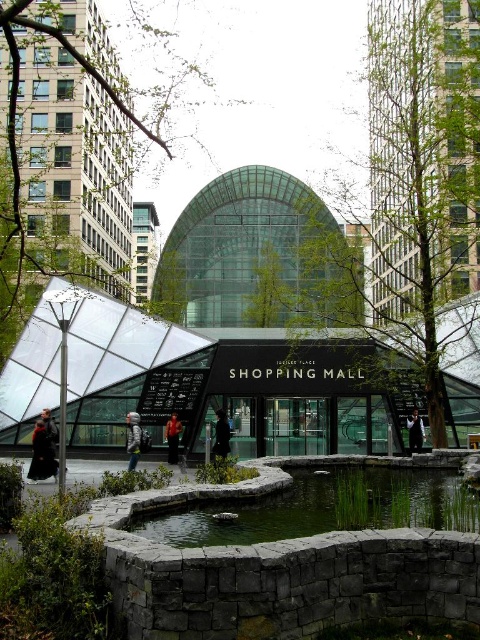
Question: Considering the relative positions of dark gray stone pond at center and denim jacket at center in the image provided, where is dark gray stone pond at center located with respect to denim jacket at center?

Choices:
 (A) right
 (B) left

Answer: (A)

Question: Does denim jacket at center have a smaller size compared to dark gray jacket at center?

Choices:
 (A) no
 (B) yes

Answer: (B)

Question: Which is farther from the black leather coat at lower left?

Choices:
 (A) dark blue jacket at center
 (B) denim jacket at center
 (C) dark gray jacket at center

Answer: (C)

Question: Estimate the real-world distances between objects in this image. Which object is farther from the gray wool coat at center?

Choices:
 (A) dark gray jacket at center
 (B) denim jacket at center
 (C) green stone pond at center

Answer: (A)

Question: Does dark gray stone pond at center have a smaller size compared to dark blue jacket at center?

Choices:
 (A) yes
 (B) no

Answer: (B)

Question: Which point appears farthest from the camera in this image?

Choices:
 (A) (220, 452)
 (B) (356, 486)
 (C) (48, 442)

Answer: (A)